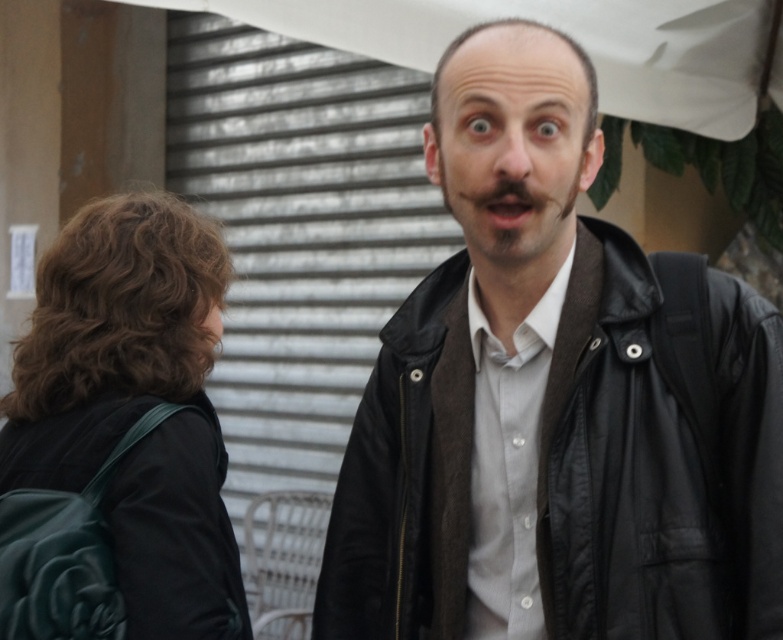
You are standing in front of the two people in the image. Which object is positioned to the right of the other between the black leather jacket at center and the brown fuzzy beard at center?

The black leather jacket at center is to the right of the brown fuzzy beard at center.

Based on the scene description, which object is taller between the dark brown hair at left and the brown fuzzy beard at center?

The dark brown hair at left is taller than the brown fuzzy beard at center according to the description.